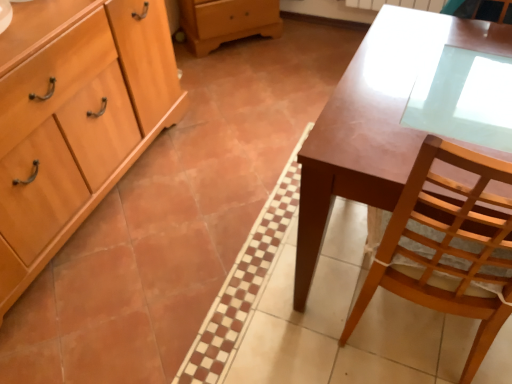
This screenshot has width=512, height=384. What do you see at coordinates (374, 122) in the screenshot? I see `matte brown desk at center` at bounding box center [374, 122].

Measure the distance between point (392, 160) and camera.

The depth of point (392, 160) is 37.01 inches.

Find the location of a particular element. This screenshot has height=384, width=512. matte brown desk at center is located at coordinates (374, 122).

Where is `light wood cabinet at left`? The height and width of the screenshot is (384, 512). light wood cabinet at left is located at coordinates (78, 127).

The image size is (512, 384). Describe the element at coordinates (78, 127) in the screenshot. I see `light wood cabinet at left` at that location.

In order to click on matte brown desk at center in this screenshot , I will do `click(374, 122)`.

Which is more to the left, light wood cabinet at left or matte brown desk at center?

light wood cabinet at left is more to the left.

Which is behind, light wood cabinet at left or matte brown desk at center?

light wood cabinet at left is further from the camera.

Between point (109, 65) and point (395, 197), which one is positioned behind?

The point (109, 65) is more distant.

From the image's perspective, is light wood cabinet at left located above or below matte brown desk at center?

Clearly, from the image's perspective, light wood cabinet at left is above matte brown desk at center.

From a real-world perspective, is light wood cabinet at left physically located above or below matte brown desk at center?

From a real-world perspective, light wood cabinet at left is physically above matte brown desk at center.

Is light wood cabinet at left wider than matte brown desk at center?

No, light wood cabinet at left is not wider than matte brown desk at center.

Based on the photo, who is shorter, light wood cabinet at left or matte brown desk at center?

With less height is matte brown desk at center.

Based on their sizes in the image, would you say light wood cabinet at left is bigger or smaller than matte brown desk at center?

In the image, light wood cabinet at left appears to be larger than matte brown desk at center.

Is matte brown desk at center completely or partially inside light wood cabinet at left?

No, matte brown desk at center is located outside of light wood cabinet at left.

Is light wood cabinet at left directly adjacent to matte brown desk at center?

There is a gap between light wood cabinet at left and matte brown desk at center.

In the scene shown: Is light wood cabinet at left oriented towards matte brown desk at center?

Yes, light wood cabinet at left is turned towards matte brown desk at center.

Where is `desk beneath the light wood cabinet at left (from a real-world perspective)`? This screenshot has height=384, width=512. desk beneath the light wood cabinet at left (from a real-world perspective) is located at coordinates (374, 122).

Considering the positions of objects matte brown desk at center and light wood cabinet at left in the image provided, who is more to the right, matte brown desk at center or light wood cabinet at left?

From the viewer's perspective, matte brown desk at center appears more on the right side.

Is matte brown desk at center positioned before light wood cabinet at left?

Yes, matte brown desk at center is in front of light wood cabinet at left.

Is point (447, 168) positioned after point (57, 1)?

That is False.

From the image's perspective, is matte brown desk at center above light wood cabinet at left?

No, from the image's perspective, matte brown desk at center is not above light wood cabinet at left.

From a real-world perspective, is matte brown desk at center located beneath light wood cabinet at left?

Indeed, from a real-world perspective, matte brown desk at center is positioned beneath light wood cabinet at left.

Is matte brown desk at center wider or thinner than light wood cabinet at left?

In the image, matte brown desk at center appears to be wider than light wood cabinet at left.

Which of these two, matte brown desk at center or light wood cabinet at left, stands taller?

With more height is light wood cabinet at left.

Is matte brown desk at center smaller than light wood cabinet at left?

Correct, matte brown desk at center occupies less space than light wood cabinet at left.

Does matte brown desk at center contain light wood cabinet at left?

That's incorrect, light wood cabinet at left is not inside matte brown desk at center.

Is matte brown desk at center not near light wood cabinet at left?

That's right, there is a large distance between matte brown desk at center and light wood cabinet at left.

Does matte brown desk at center turn towards light wood cabinet at left?

No, matte brown desk at center is not turned towards light wood cabinet at left.

How many degrees apart are the facing directions of matte brown desk at center and light wood cabinet at left?

matte brown desk at center and light wood cabinet at left are facing 91.1 degrees away from each other.

The width and height of the screenshot is (512, 384). In order to click on cabinetry that is behind the matte brown desk at center in this screenshot , I will do `click(78, 127)`.

At what (x,y) coordinates should I click in order to perform the action: click on desk beneath the light wood cabinet at left (from a real-world perspective). Please return your answer as a coordinate pair (x, y). This screenshot has width=512, height=384. Looking at the image, I should click on (374, 122).

Image resolution: width=512 pixels, height=384 pixels. Identify the location of cabinetry on the left of matte brown desk at center. (78, 127).